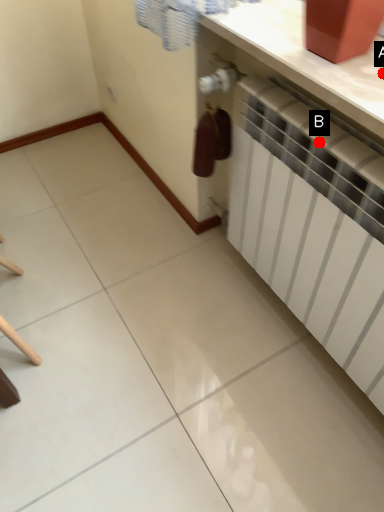
Question: Two points are circled on the image, labeled by A and B beside each circle. Among these points, which one is nearest to the camera?

Choices:
 (A) A is closer
 (B) B is closer

Answer: (A)